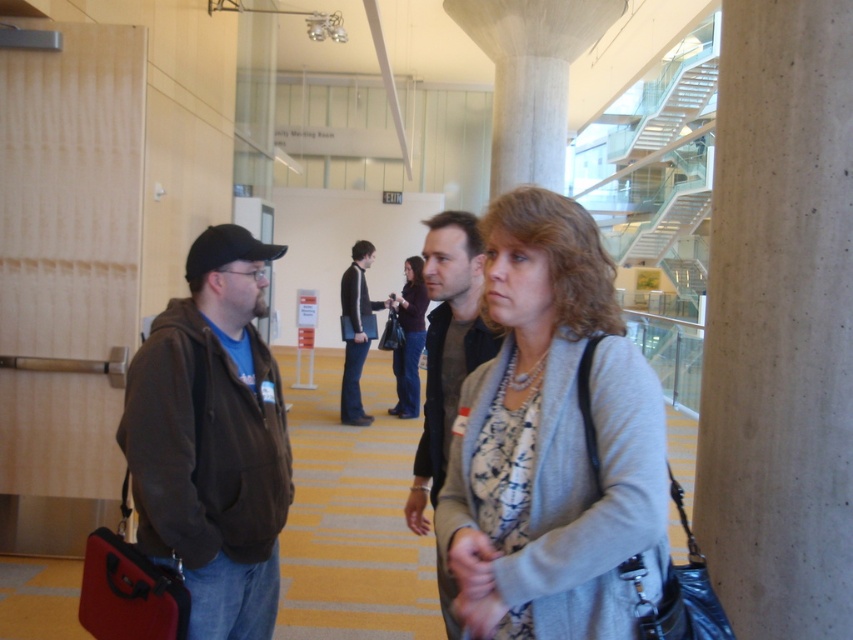
Is gray knit sweater at center positioned behind dark gray jacket at center?

No.

Can you confirm if gray knit sweater at center is bigger than dark gray jacket at center?

No, gray knit sweater at center is not bigger than dark gray jacket at center.

Is point (596, 444) less distant than point (461, 276)?

Yes.

At what (x,y) coordinates should I click in order to perform the action: click on gray knit sweater at center. Please return your answer as a coordinate pair (x, y). Looking at the image, I should click on (552, 442).

At what (x,y) coordinates should I click in order to perform the action: click on concrete at right. Please return your answer as a coordinate pair (x, y). The height and width of the screenshot is (640, 853). Looking at the image, I should click on (780, 323).

Is point (735, 308) positioned before point (445, 285)?

No, (735, 308) is behind (445, 285).

Is point (741, 602) positioned behind point (456, 385)?

No, (741, 602) is closer to viewer.

The height and width of the screenshot is (640, 853). I want to click on concrete at right, so click(x=780, y=323).

Is concrete at right taller than gray knit sweater at center?

Correct, concrete at right is much taller as gray knit sweater at center.

Who is higher up, concrete at right or gray knit sweater at center?

concrete at right is higher up.

Between point (759, 628) and point (608, 445), which one is positioned in front?

Point (608, 445) is in front.

Find the location of `concrete at right`. concrete at right is located at coordinates click(780, 323).